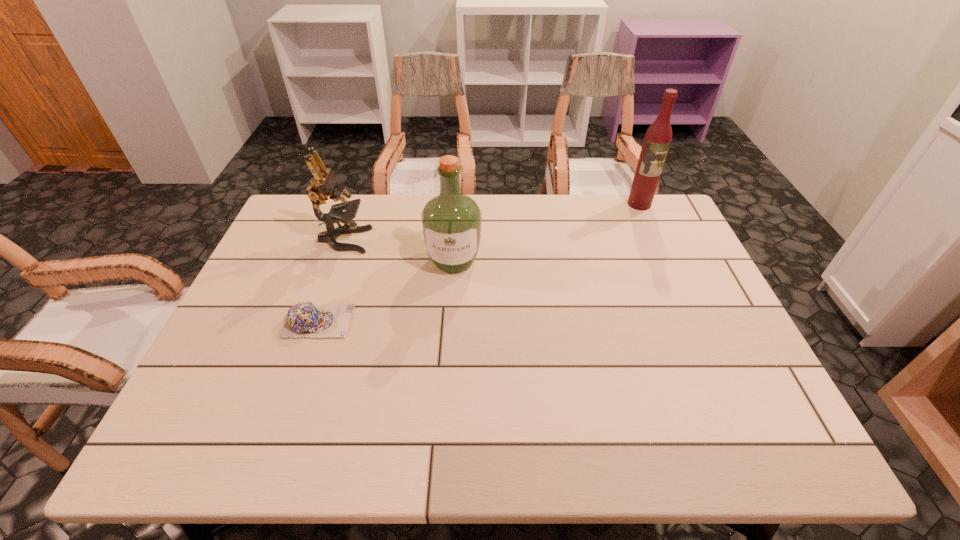
Locate an element on the screen. the farthest object is located at coordinates (658, 137).

Where is `the right liquor`? the right liquor is located at coordinates (658, 137).

The width and height of the screenshot is (960, 540). Identify the location of the second object from right to left. (451, 222).

The height and width of the screenshot is (540, 960). In order to click on the left liquor in this screenshot , I will do `click(451, 222)`.

I want to click on microscope, so click(323, 182).

In order to click on the nearest object in this screenshot , I will do `click(304, 319)`.

Where is `cap`? This screenshot has width=960, height=540. cap is located at coordinates (304, 319).

I want to click on vacant space located on the label of the rightmost object, so click(x=660, y=251).

What are the coordinates of `free space located 0.250m on the front-facing side of the nearer liquor` in the screenshot? It's located at (448, 353).

Locate an element on the screen. This screenshot has width=960, height=540. free region located 0.110m at the eyepieces of the microscope is located at coordinates (405, 240).